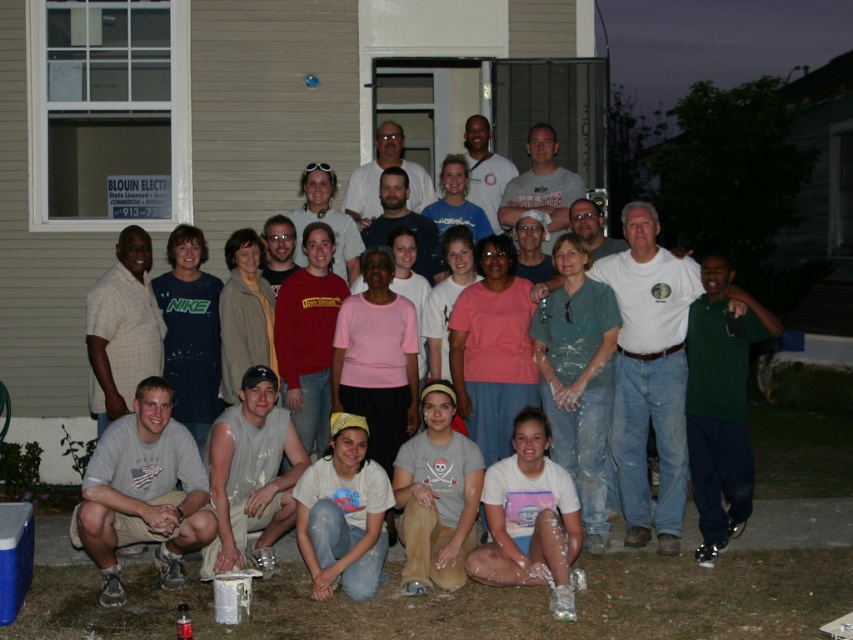
Question: Which of the following is the closest to the observer?

Choices:
 (A) (129, 436)
 (B) (132, 362)

Answer: (A)

Question: Which point is closer to the camera?

Choices:
 (A) dark green shirt at lower right
 (B) gray cotton t-shirt at lower left
 (C) white matte t-shirts at center
 (D) plaid shirt at center

Answer: (B)

Question: Does gray cotton t-shirt at lower left appear on the left side of matte white shirt at center?

Choices:
 (A) no
 (B) yes

Answer: (B)

Question: Can you confirm if white cotton shirt at center is wider than matte white shirt at center?

Choices:
 (A) yes
 (B) no

Answer: (B)

Question: Observing the image, what is the correct spatial positioning of white cotton shirt at lower center in reference to matte white shirt at center?

Choices:
 (A) below
 (B) above

Answer: (A)

Question: Which point is farther to the camera?

Choices:
 (A) (740, 371)
 (B) (132, 378)

Answer: (B)